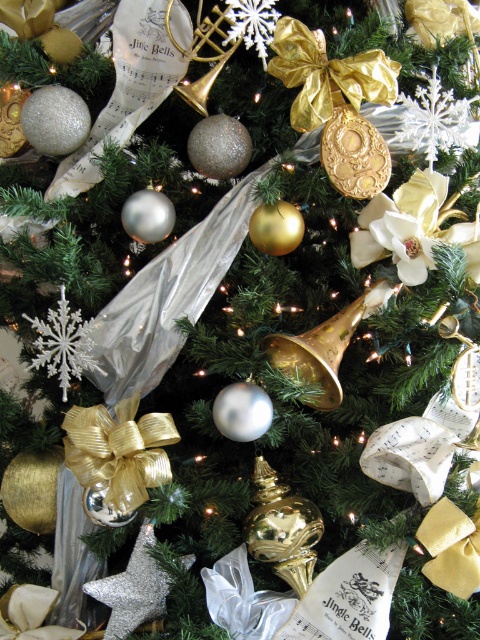
Does gold metallic trumpet at center appear under gold metallic trumpet at upper center?

Correct, gold metallic trumpet at center is located below gold metallic trumpet at upper center.

Is gold metallic trumpet at center positioned at the back of gold metallic trumpet at upper center?

That is True.

Where is `gold metallic trumpet at center`? gold metallic trumpet at center is located at coordinates (324, 348).

Image resolution: width=480 pixels, height=640 pixels. What are the coordinates of `gold shiny ribbon at center` in the screenshot? It's located at (117, 458).

Describe the element at coordinates (117, 458) in the screenshot. I see `gold shiny ribbon at center` at that location.

Identify the location of gold shiny ribbon at center. This screenshot has width=480, height=640. (117, 458).

Which of these two, gold shiny ribbon at upper center or gold metallic trumpet at upper center, stands shorter?

gold metallic trumpet at upper center

Can you confirm if gold shiny ribbon at upper center is positioned to the left of gold metallic trumpet at upper center?

In fact, gold shiny ribbon at upper center is to the right of gold metallic trumpet at upper center.

The height and width of the screenshot is (640, 480). What are the coordinates of `gold shiny ribbon at upper center` in the screenshot? It's located at (326, 74).

Identify the location of gold shiny ribbon at upper center. Image resolution: width=480 pixels, height=640 pixels. (326, 74).